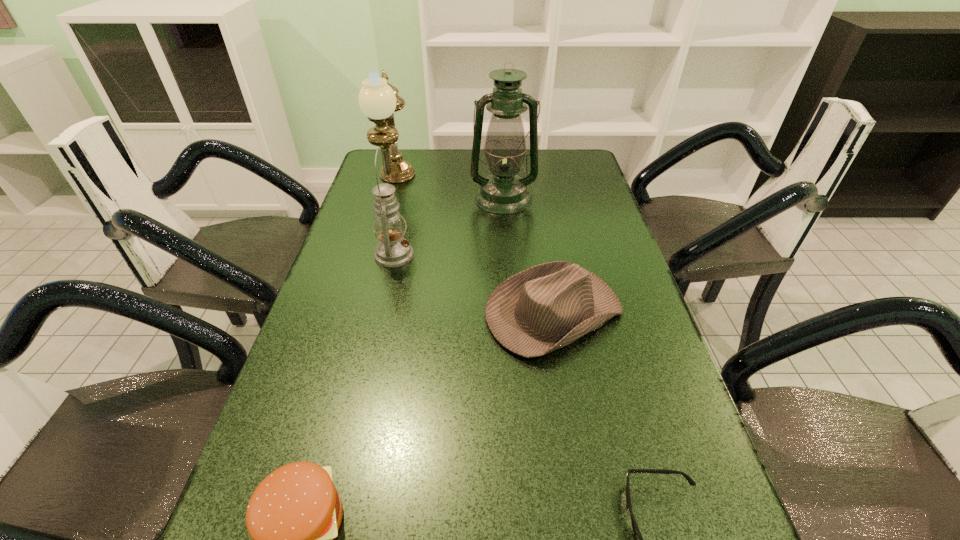
Locate an element on the screen. blank space that satisfies the following two spatial constraints: 1. on the front side of the third shortest object; 2. on the right side of the nearest oil lamp is located at coordinates (381, 314).